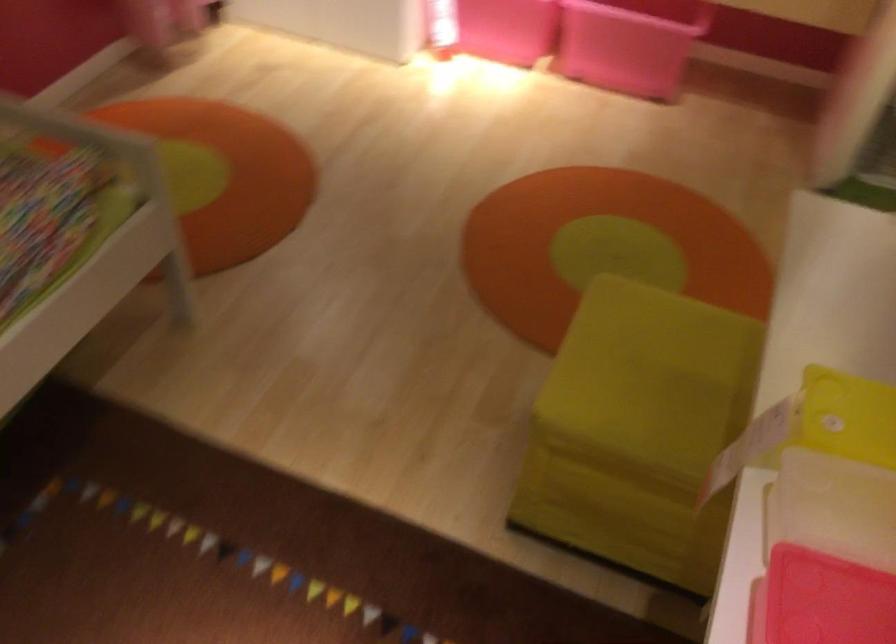
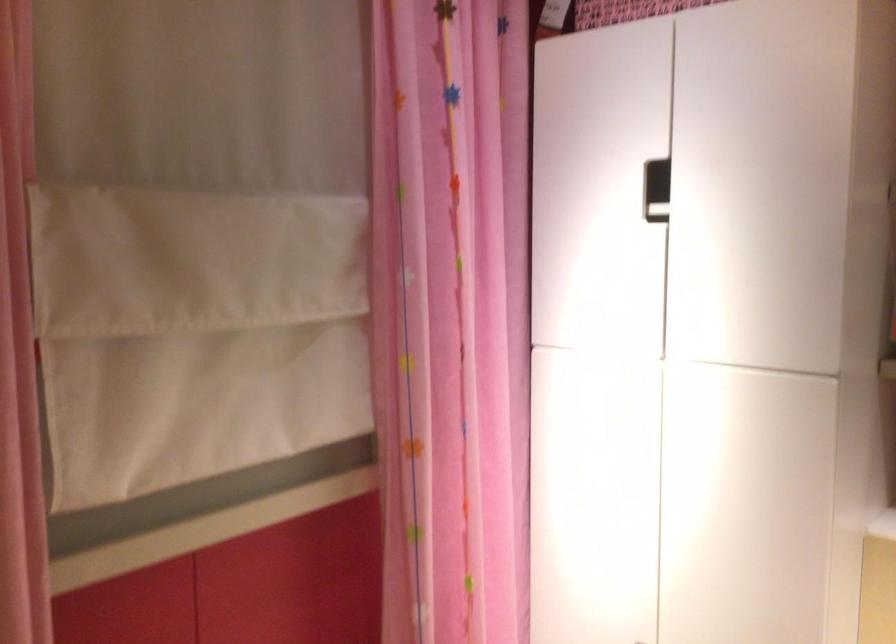
How did the camera likely rotate?

The rotation direction of the camera is left-up.